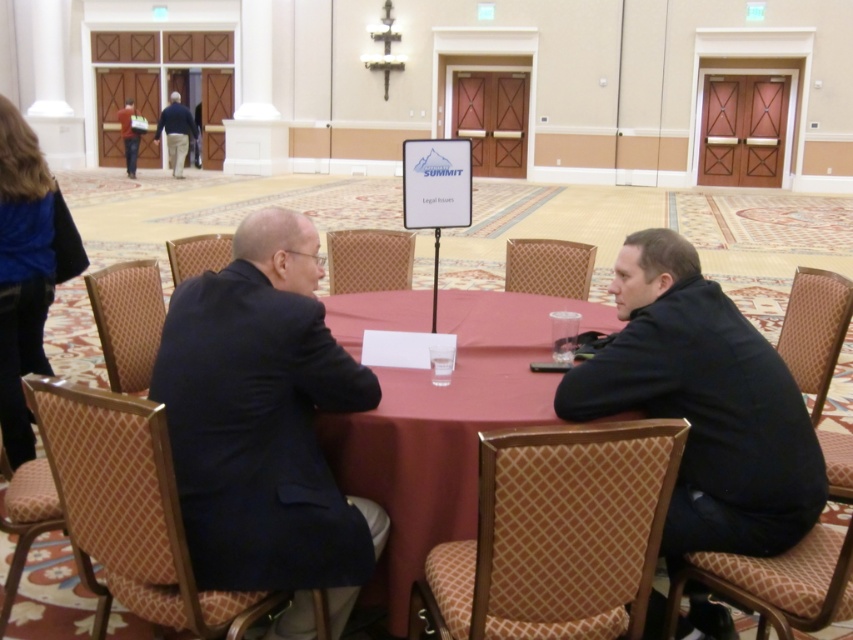
Question: Which point is farther to the camera?

Choices:
 (A) (177, 154)
 (B) (485, 356)
 (C) (300, 396)
 (D) (639, 289)

Answer: (A)

Question: Among these objects, which one is farthest from the camera?

Choices:
 (A) maroon fabric table at center
 (B) dark blue jacket at upper left
 (C) dark blue suit at center
 (D) black matte jacket at right

Answer: (B)

Question: Based on their relative distances, which object is farther from the black matte jacket at right?

Choices:
 (A) dark blue shirt at upper left
 (B) dark blue suit at center
 (C) maroon fabric table at center
 (D) dark blue jacket at upper left

Answer: (A)

Question: Does black matte jacket at right appear under dark blue shirt at upper left?

Choices:
 (A) no
 (B) yes

Answer: (B)

Question: Does dark blue suit at center appear on the left side of maroon fabric table at center?

Choices:
 (A) yes
 (B) no

Answer: (A)

Question: Can you confirm if dark blue suit at center is bigger than dark blue jacket at upper left?

Choices:
 (A) no
 (B) yes

Answer: (A)